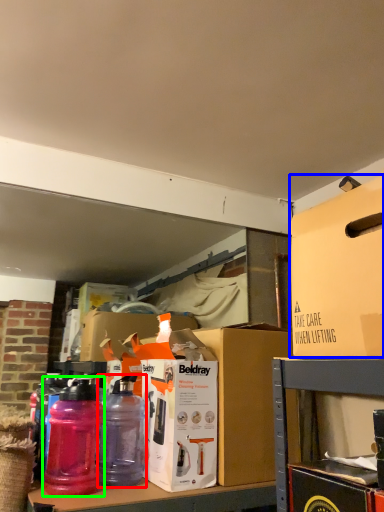
Question: Which object is the farthest from bottle (highlighted by a red box)? Choose among these: box (highlighted by a blue box) or bottle (highlighted by a green box).

Choices:
 (A) box
 (B) bottle

Answer: (A)